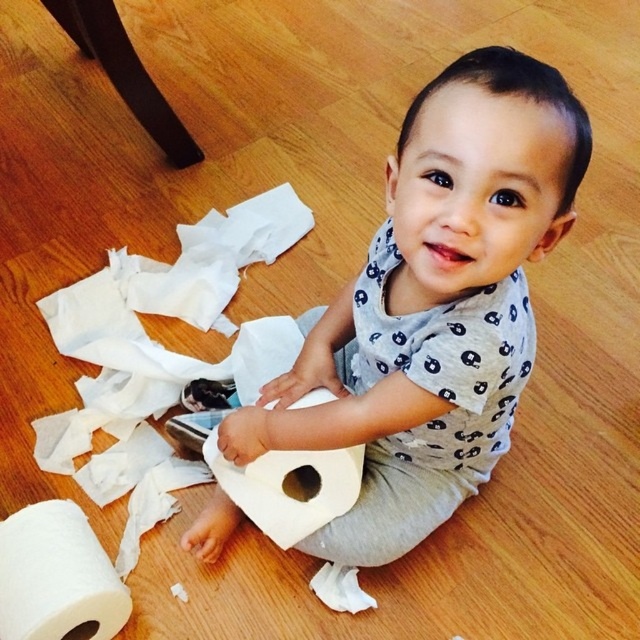
Question: Estimate the real-world distances between objects in this image. Which object is closer to the white matte paper towel at center?

Choices:
 (A) white paper at center
 (B) white matte paper towel at lower left

Answer: (A)

Question: Observing the image, what is the correct spatial positioning of white matte paper towel at lower left in reference to white paper at center?

Choices:
 (A) right
 (B) left

Answer: (B)

Question: Which object is farther from the camera taking this photo?

Choices:
 (A) white matte paper towel at center
 (B) white matte paper towel at lower left

Answer: (B)

Question: Among these points, which one is nearest to the camera?

Choices:
 (A) (17, 634)
 (B) (307, 499)

Answer: (A)

Question: Is white matte paper towel at center to the left of white paper at center from the viewer's perspective?

Choices:
 (A) yes
 (B) no

Answer: (B)

Question: Observing the image, what is the correct spatial positioning of white matte paper towel at center in reference to white paper at center?

Choices:
 (A) right
 (B) left

Answer: (A)